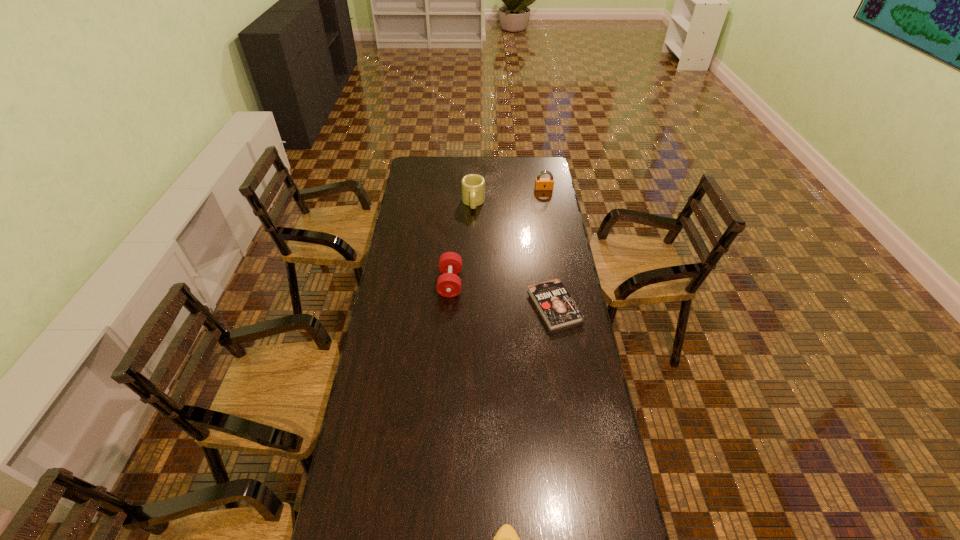
Where is `free location at the far edge of the desktop`? free location at the far edge of the desktop is located at coordinates (512, 177).

The image size is (960, 540). In the image, there is a desktop. Find the location of `vacant space at the left edge`. vacant space at the left edge is located at coordinates (395, 340).

Where is `vacant space at the right edge of the desktop`? vacant space at the right edge of the desktop is located at coordinates (553, 339).

Where is `blank space at the far left corner of the desktop`? blank space at the far left corner of the desktop is located at coordinates (429, 161).

This screenshot has height=540, width=960. Find the location of `unoccupied position between the padlock and the mug`. unoccupied position between the padlock and the mug is located at coordinates (509, 196).

Locate an element on the screen. The height and width of the screenshot is (540, 960). blank region between the shortest object and the second farthest object is located at coordinates (514, 254).

Image resolution: width=960 pixels, height=540 pixels. I want to click on vacant point located between the mug and the dumbbell, so click(x=462, y=243).

The image size is (960, 540). In order to click on vacant area that lies between the mug and the padlock in this screenshot , I will do `click(509, 196)`.

Where is `vacant space in between the second farthest object and the padlock`? Image resolution: width=960 pixels, height=540 pixels. vacant space in between the second farthest object and the padlock is located at coordinates (509, 196).

You are a GUI agent. You are given a task and a screenshot of the screen. Output one action in this format:
    pyautogui.click(x=<x>, y=<y>)
    Task: Click on the vacant area between the padlock and the dumbbell
    The width and height of the screenshot is (960, 540).
    Given the screenshot: What is the action you would take?
    pyautogui.click(x=497, y=236)